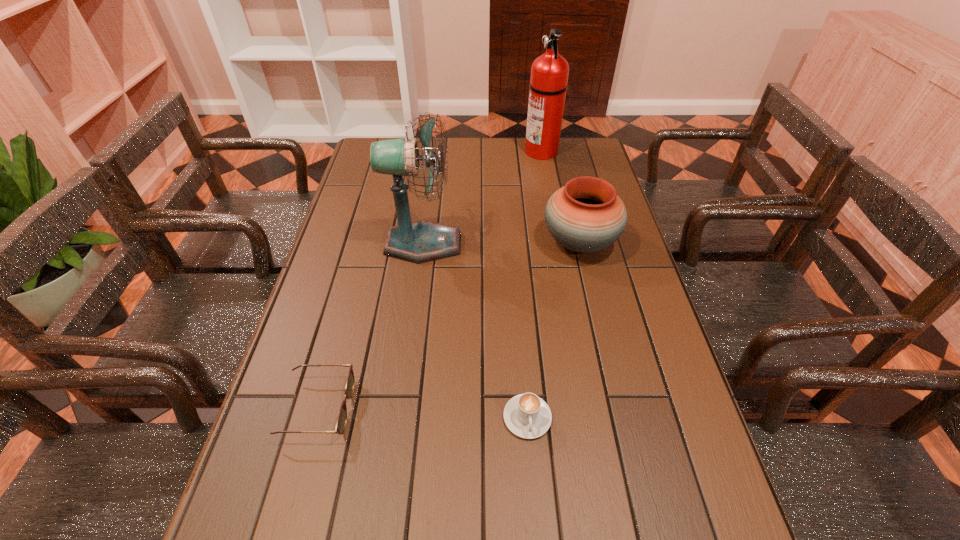
The height and width of the screenshot is (540, 960). I want to click on fire extinguisher, so click(x=549, y=73).

Locate an element on the screen. The height and width of the screenshot is (540, 960). fan is located at coordinates (422, 241).

Locate an element on the screen. Image resolution: width=960 pixels, height=540 pixels. pottery is located at coordinates (586, 215).

This screenshot has width=960, height=540. I want to click on cappuccino, so click(526, 415).

Image resolution: width=960 pixels, height=540 pixels. In order to click on spectacles in this screenshot , I will do `click(341, 422)`.

At what (x,y) coordinates should I click in order to perform the action: click on vacant space located at the nozzle of the fire extinguisher. Please return your answer as a coordinate pair (x, y). This screenshot has height=540, width=960. Looking at the image, I should click on (419, 151).

This screenshot has height=540, width=960. I want to click on free space located 0.340m at the nozzle of the fire extinguisher, so click(x=434, y=151).

Locate an element on the screen. vacant space located at the nozzle of the fire extinguisher is located at coordinates (432, 151).

Where is `vacant space located in front of the fan where the wind blows`? This screenshot has height=540, width=960. vacant space located in front of the fan where the wind blows is located at coordinates click(565, 244).

The width and height of the screenshot is (960, 540). Find the location of `free space located 0.230m on the front of the third shortest object`. free space located 0.230m on the front of the third shortest object is located at coordinates pos(602,337).